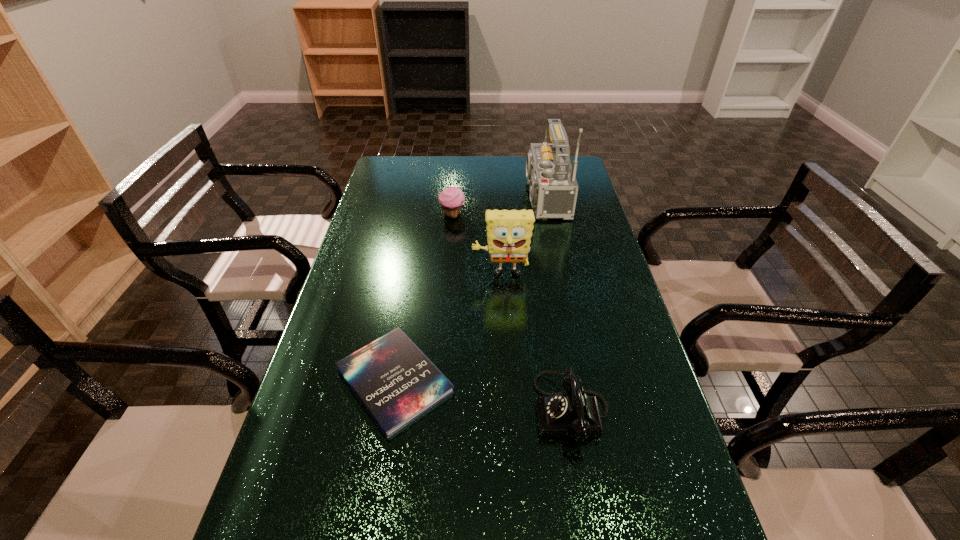
Find the location of a particular element. the tallest object is located at coordinates (553, 186).

Locate an element on the screen. the fourth shortest object is located at coordinates (508, 232).

Find the location of a particular element. The height and width of the screenshot is (540, 960). sponge is located at coordinates click(508, 232).

This screenshot has width=960, height=540. Find the location of `cupcake`. cupcake is located at coordinates (452, 199).

What are the coordinates of `telephone` in the screenshot? It's located at point(572,413).

Identify the location of the shortest object. This screenshot has width=960, height=540. (393, 379).

Find the location of a particular element. The height and width of the screenshot is (540, 960). vacant space located on the front-facing side of the tallest object is located at coordinates (474, 197).

Identify the location of vacant space located on the front-facing side of the tallest object. This screenshot has height=540, width=960. click(x=414, y=197).

Where is `free space located on the front-facing side of the tallest object`? Image resolution: width=960 pixels, height=540 pixels. free space located on the front-facing side of the tallest object is located at coordinates (468, 197).

The height and width of the screenshot is (540, 960). Find the location of `blank space located 0.120m on the face of the second tallest object`. blank space located 0.120m on the face of the second tallest object is located at coordinates (503, 314).